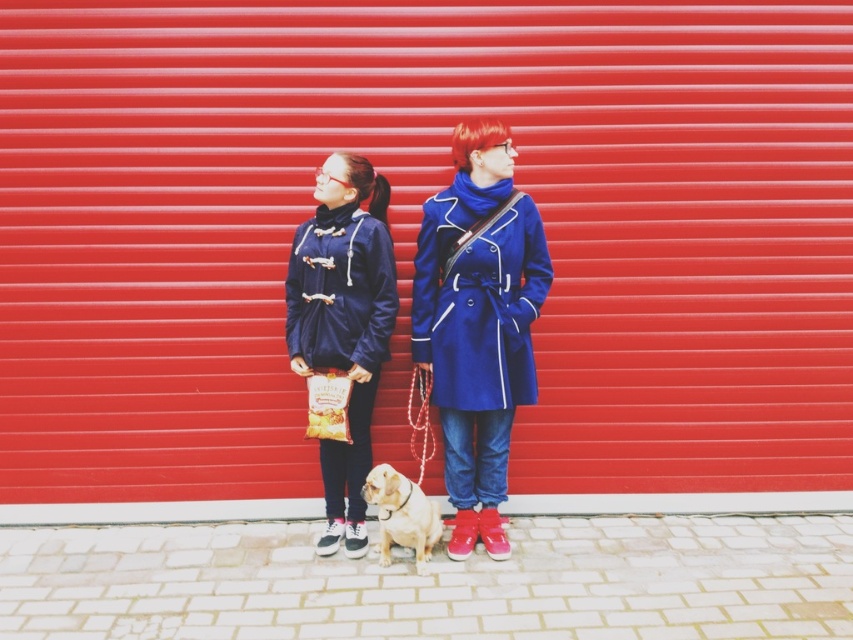
Question: Among these objects, which one is farthest from the camera?

Choices:
 (A) matte blue duffle coat at center
 (B) blue woolen coat at center

Answer: (A)

Question: Based on their relative distances, which object is farther from the matte blue coat at center?

Choices:
 (A) blue woolen coat at center
 (B) matte blue duffle coat at center
 (C) navy blue fabric jacket at center

Answer: (C)

Question: Which point is farther to the camera?

Choices:
 (A) matte blue coat at center
 (B) blue woolen coat at center
 (C) navy blue fabric jacket at center
 (D) golden fur dog at center

Answer: (C)

Question: Is navy blue fabric jacket at center thinner than matte blue duffle coat at center?

Choices:
 (A) yes
 (B) no

Answer: (A)

Question: Can you confirm if navy blue fabric jacket at center is bigger than blue woolen coat at center?

Choices:
 (A) no
 (B) yes

Answer: (B)

Question: Is navy blue fabric jacket at center above matte blue duffle coat at center?

Choices:
 (A) no
 (B) yes

Answer: (A)